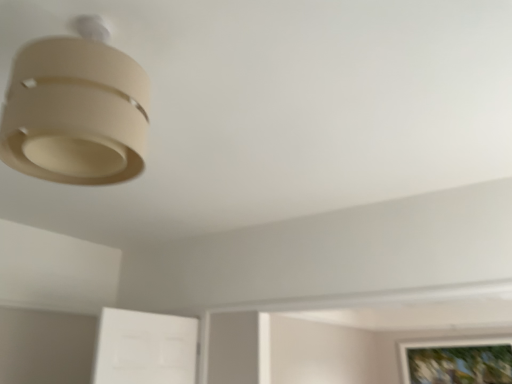
Measure the distance between point (22, 157) and camera.

The depth of point (22, 157) is 3.62 feet.

Describe the element at coordinates (76, 110) in the screenshot. I see `matte beige lampshade at upper left` at that location.

Identify the location of matte beige lampshade at upper left. This screenshot has height=384, width=512. [76, 110].

Describe the element at coordinates (457, 361) in the screenshot. The image size is (512, 384). I see `wooden framed picture at lower right` at that location.

This screenshot has height=384, width=512. What are the coordinates of `wooden framed picture at lower right` in the screenshot? It's located at (457, 361).

The height and width of the screenshot is (384, 512). In order to click on matte beige lampshade at upper left in this screenshot , I will do `click(76, 110)`.

Is matte beige lampshade at upper left at the left side of wooden framed picture at lower right?

Yes, matte beige lampshade at upper left is to the left of wooden framed picture at lower right.

Which object is more forward, matte beige lampshade at upper left or wooden framed picture at lower right?

matte beige lampshade at upper left.

Which is more distant, [41,132] or [432,368]?

Point [432,368]

From the image's perspective, is matte beige lampshade at upper left located beneath wooden framed picture at lower right?

Actually, matte beige lampshade at upper left appears above wooden framed picture at lower right in the image.

From a real-world perspective, who is located lower, matte beige lampshade at upper left or wooden framed picture at lower right?

In real-world perspective, wooden framed picture at lower right is lower.

Does matte beige lampshade at upper left have a lesser width compared to wooden framed picture at lower right?

Incorrect, the width of matte beige lampshade at upper left is not less than that of wooden framed picture at lower right.

From their relative heights in the image, would you say matte beige lampshade at upper left is taller or shorter than wooden framed picture at lower right?

In the image, matte beige lampshade at upper left appears to be shorter than wooden framed picture at lower right.

Does matte beige lampshade at upper left have a smaller size compared to wooden framed picture at lower right?

Actually, matte beige lampshade at upper left might be larger than wooden framed picture at lower right.

Is wooden framed picture at lower right surrounded by matte beige lampshade at upper left?

No, matte beige lampshade at upper left does not contain wooden framed picture at lower right.

Is matte beige lampshade at upper left directly adjacent to wooden framed picture at lower right?

They are not placed beside each other.

Is matte beige lampshade at upper left facing away from wooden framed picture at lower right?

matte beige lampshade at upper left does not have its back to wooden framed picture at lower right.

Measure the distance between matte beige lampshade at upper left and wooden framed picture at lower right.

matte beige lampshade at upper left is 4.39 meters away from wooden framed picture at lower right.

At what (x,y) coordinates should I click in order to perform the action: click on lamp that is in front of the wooden framed picture at lower right. Please return your answer as a coordinate pair (x, y). The width and height of the screenshot is (512, 384). Looking at the image, I should click on (76, 110).

Considering the relative positions of wooden framed picture at lower right and matte beige lampshade at upper left in the image provided, is wooden framed picture at lower right to the left of matte beige lampshade at upper left from the viewer's perspective?

No, wooden framed picture at lower right is not to the left of matte beige lampshade at upper left.

In the image, is wooden framed picture at lower right positioned in front of or behind matte beige lampshade at upper left?

wooden framed picture at lower right is behind matte beige lampshade at upper left.

Considering the positions of points (459, 369) and (134, 170), is point (459, 369) closer to camera compared to point (134, 170)?

That is False.

From the image's perspective, is wooden framed picture at lower right positioned above or below matte beige lampshade at upper left?

From the image's perspective, wooden framed picture at lower right appears below matte beige lampshade at upper left.

From a real-world perspective, who is located higher, wooden framed picture at lower right or matte beige lampshade at upper left?

matte beige lampshade at upper left is physically above.

Which object is wider, wooden framed picture at lower right or matte beige lampshade at upper left?

Wider between the two is matte beige lampshade at upper left.

In terms of height, does wooden framed picture at lower right look taller or shorter compared to matte beige lampshade at upper left?

In the image, wooden framed picture at lower right appears to be taller than matte beige lampshade at upper left.

Is wooden framed picture at lower right bigger or smaller than matte beige lampshade at upper left?

Clearly, wooden framed picture at lower right is smaller in size than matte beige lampshade at upper left.

Would you say wooden framed picture at lower right is inside or outside matte beige lampshade at upper left?

wooden framed picture at lower right cannot be found inside matte beige lampshade at upper left.

Is wooden framed picture at lower right not close to matte beige lampshade at upper left?

Yes, wooden framed picture at lower right and matte beige lampshade at upper left are located far from each other.

Is matte beige lampshade at upper left at the back of wooden framed picture at lower right?

No, wooden framed picture at lower right is not facing the opposite direction of matte beige lampshade at upper left.

Locate an element on the screen. lamp that appears in front of the wooden framed picture at lower right is located at coordinates (76, 110).

Where is `lamp in front of the wooden framed picture at lower right`? Image resolution: width=512 pixels, height=384 pixels. lamp in front of the wooden framed picture at lower right is located at coordinates (76, 110).

Where is `lamp above the wooden framed picture at lower right (from a real-world perspective)`? lamp above the wooden framed picture at lower right (from a real-world perspective) is located at coordinates (76, 110).